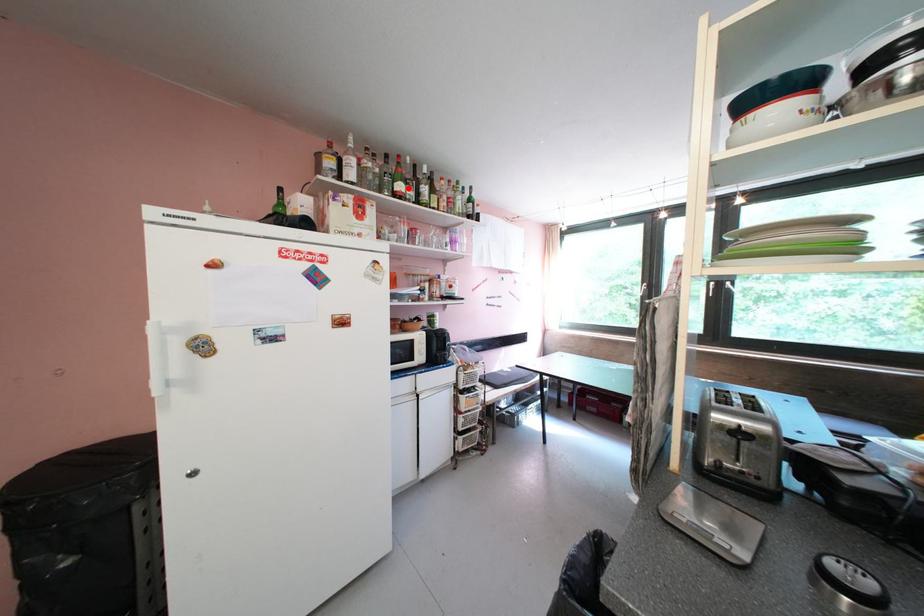
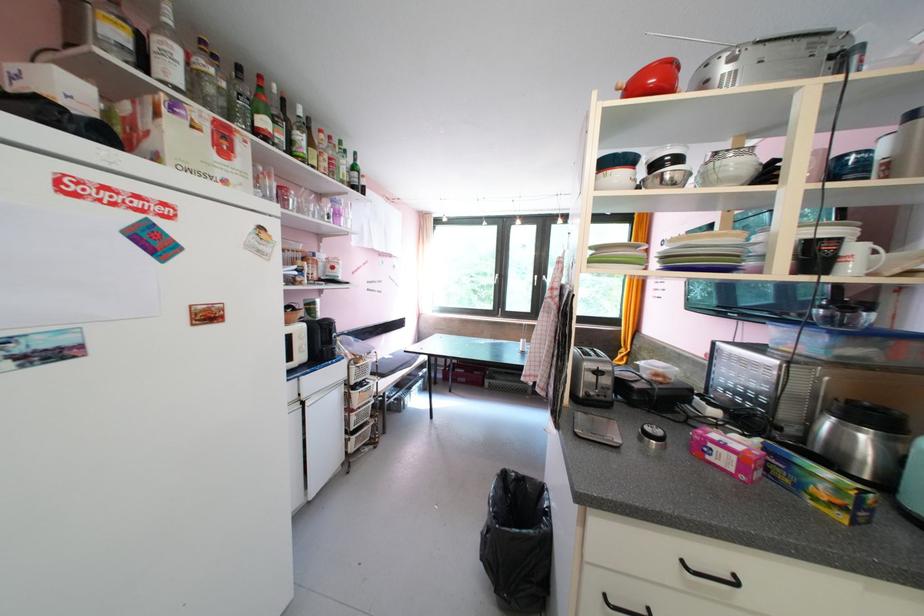
The point at the highlighted location is marked in the first image. Where is the corresponding point in the second image?

(273, 124)